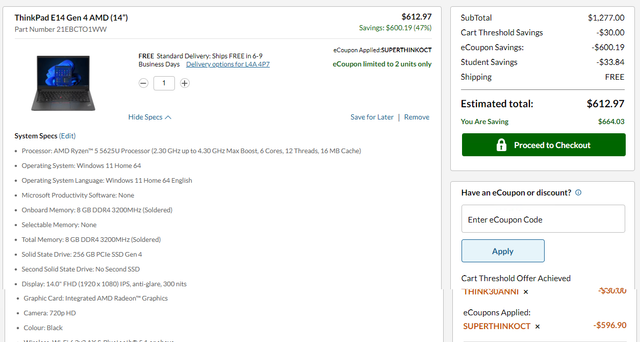
Where is `laptop`? This screenshot has height=342, width=640. laptop is located at coordinates (59, 102).